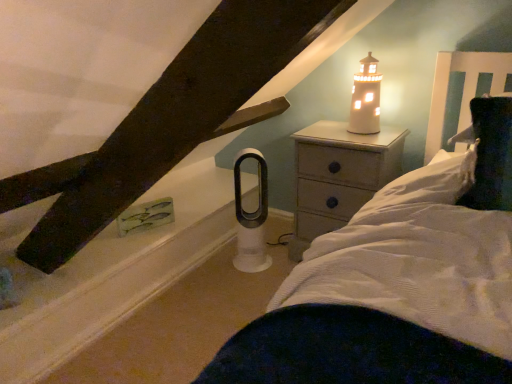
This screenshot has height=384, width=512. What are the coordinates of `free spot to the left of white ceramic lighthouse at upper right` in the screenshot? It's located at (322, 139).